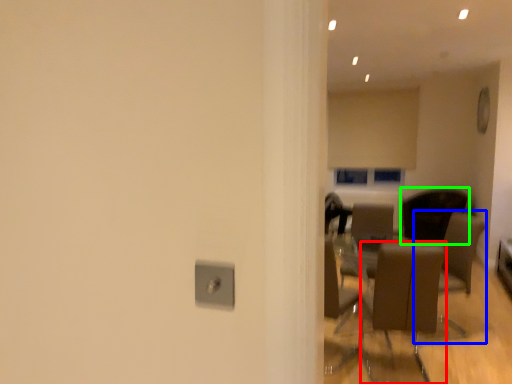
Question: Which is farther away from chair (highlighted by a red box)? armchair (highlighted by a blue box) or chair (highlighted by a green box)?

Choices:
 (A) armchair
 (B) chair

Answer: (B)